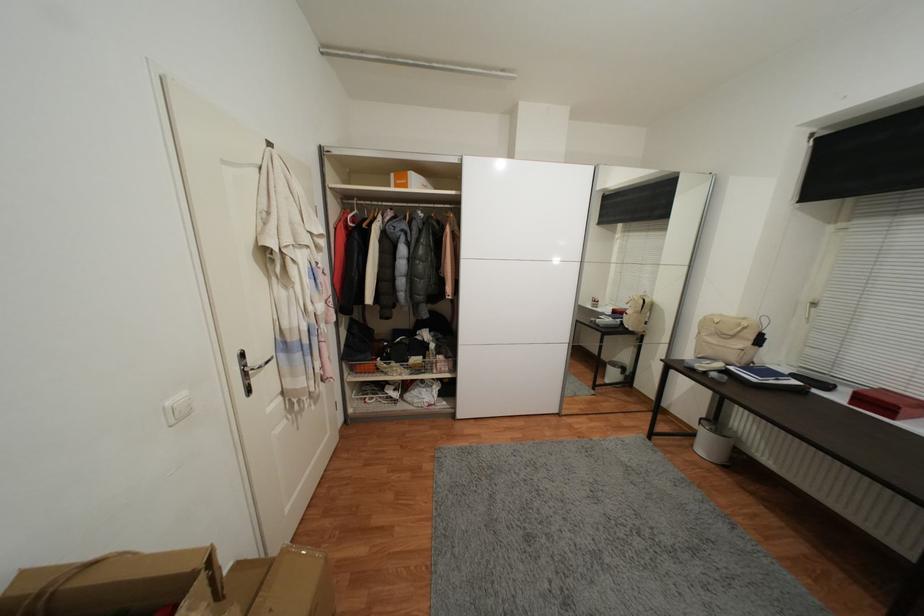
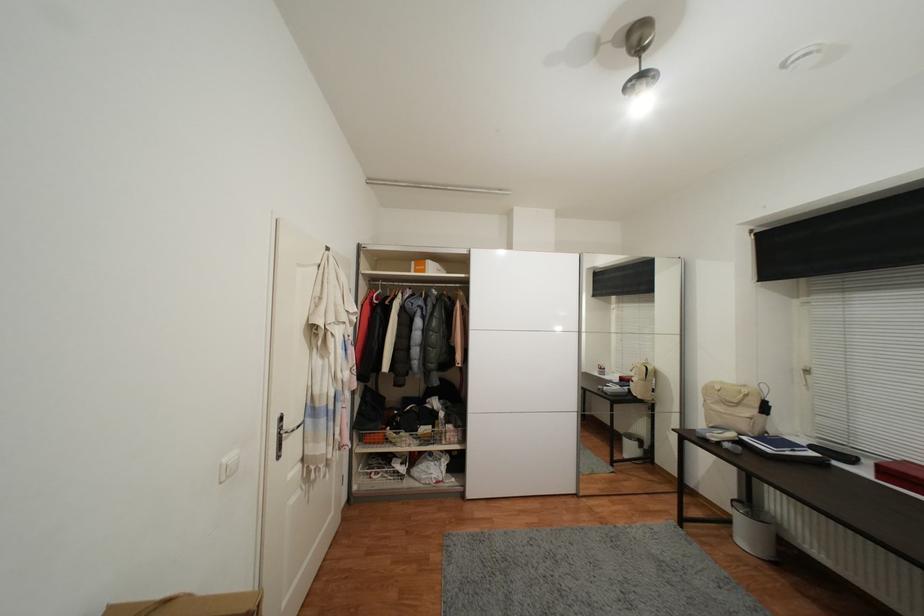
Question: The images are taken continuously from a first-person perspective. In which direction is your viewpoint rotating?

Choices:
 (A) Left
 (B) Right
 (C) Up
 (D) Down

Answer: (C)